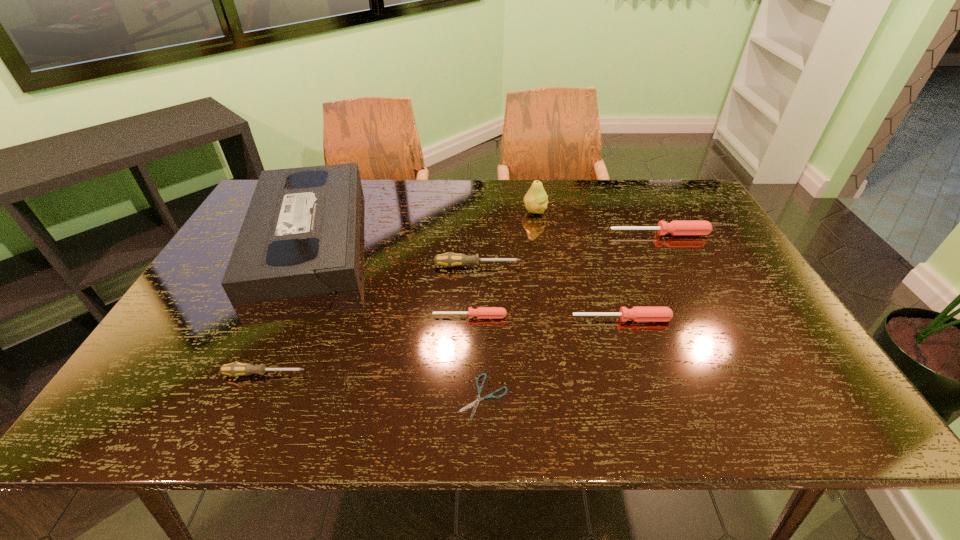
Locate an element on the screen. This screenshot has height=540, width=960. pear is located at coordinates (536, 200).

Where is `the tallest object`? This screenshot has width=960, height=540. the tallest object is located at coordinates (536, 200).

I want to click on the second tallest object, so click(300, 237).

The height and width of the screenshot is (540, 960). In order to click on the fourth nearest screwdriver in this screenshot , I will do `click(449, 259)`.

Locate an element on the screen. This screenshot has height=540, width=960. the bigger gray screwdriver is located at coordinates (449, 259).

Where is `the farthest screwdriver`? The image size is (960, 540). the farthest screwdriver is located at coordinates (677, 227).

At what (x,y) coordinates should I click in order to perform the action: click on the biggest red screwdriver. Please return your answer as a coordinate pair (x, y). Looking at the image, I should click on (677, 227).

Find the location of `the second smallest red screwdriver`. the second smallest red screwdriver is located at coordinates coord(638,314).

Find the location of a particular element. the nearest screwdriver is located at coordinates (235, 369).

You are a GUI agent. You are given a task and a screenshot of the screen. Output one action in this format:
    pyautogui.click(x=<x>, y=<y>)
    Task: Click on the smaller gray screwdriver
    The height and width of the screenshot is (540, 960).
    Given the screenshot: What is the action you would take?
    pyautogui.click(x=235, y=369)